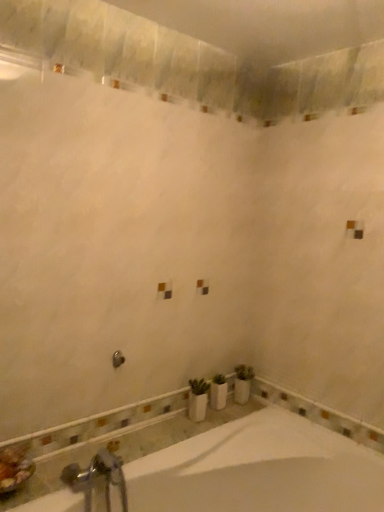
Question: Based on their positions, is white glossy bathtub at lower center located to the left or right of brushed metal shower at center?

Choices:
 (A) left
 (B) right

Answer: (B)

Question: From a real-world perspective, is white glossy bathtub at lower center physically located above or below brushed metal shower at center?

Choices:
 (A) above
 (B) below

Answer: (B)

Question: Which object is the farthest from the white ceramic vase at lower center?

Choices:
 (A) brushed metal shower at center
 (B) silver metallic faucet at lower left
 (C) white glossy bathtub at lower center

Answer: (B)

Question: Based on their relative distances, which object is farther from the silver metallic faucet at lower left?

Choices:
 (A) white glossy bathtub at lower center
 (B) brushed metal shower at center
 (C) white ceramic vase at lower center

Answer: (C)